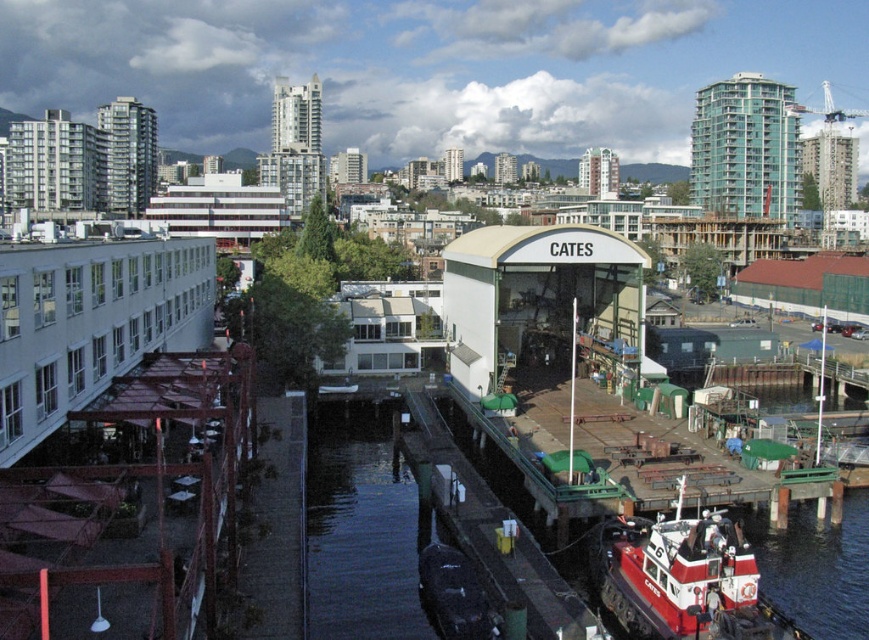
Question: Among these objects, which one is farthest from the camera?

Choices:
 (A) red painted steel tugboat at lower right
 (B) shiny black boat at lower center
 (C) green matte dock at lower right

Answer: (B)

Question: Is rustic wood dock at lower left positioned in front of green matte dock at lower right?

Choices:
 (A) no
 (B) yes

Answer: (B)

Question: Can you confirm if red painted steel tugboat at lower right is thinner than green matte dock at lower right?

Choices:
 (A) no
 (B) yes

Answer: (B)

Question: Estimate the real-world distances between objects in this image. Which object is closer to the shiny black boat at lower center?

Choices:
 (A) green matte dock at lower right
 (B) red painted steel tugboat at lower right
 (C) rustic wood dock at lower left

Answer: (A)

Question: Estimate the real-world distances between objects in this image. Which object is farther from the red painted steel tugboat at lower right?

Choices:
 (A) green matte dock at lower right
 (B) rustic wood dock at lower left

Answer: (B)

Question: Considering the relative positions of rustic wood dock at lower left and green matte dock at lower right in the image provided, where is rustic wood dock at lower left located with respect to green matte dock at lower right?

Choices:
 (A) below
 (B) above

Answer: (B)